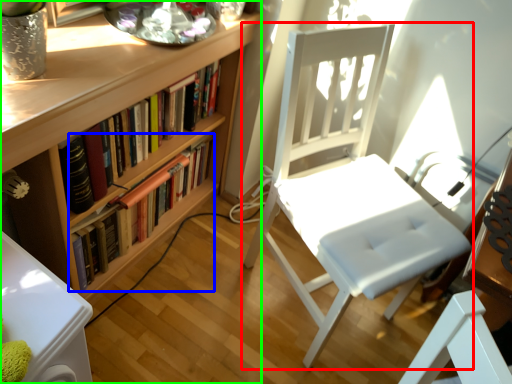
Question: Considering the real-world distances, which object is closest to chair (highlighted by a red box)? book (highlighted by a blue box) or bookcase (highlighted by a green box).

Choices:
 (A) book
 (B) bookcase

Answer: (B)